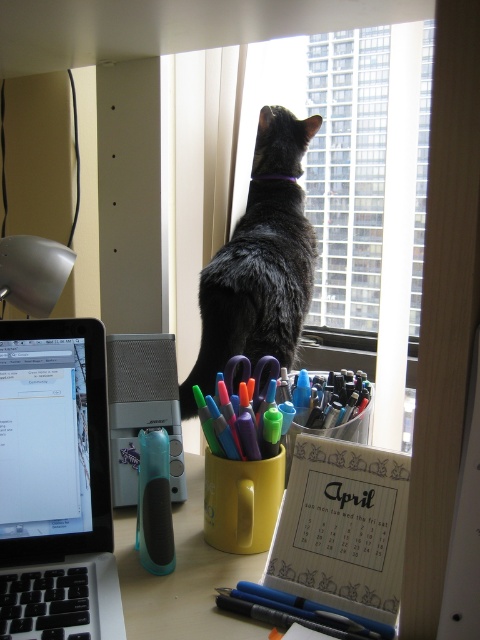
Does silver metallic laptop at left appear on the right side of matte black pen at lower center?

No, silver metallic laptop at left is not to the right of matte black pen at lower center.

Can you confirm if silver metallic laptop at left is positioned to the left of matte black pen at lower center?

Yes, silver metallic laptop at left is to the left of matte black pen at lower center.

Is point (20, 433) closer to viewer compared to point (255, 596)?

No, (20, 433) is behind (255, 596).

At what (x,y) coordinates should I click in order to perform the action: click on silver metallic laptop at left. Please return your answer as a coordinate pair (x, y). The width and height of the screenshot is (480, 640). Looking at the image, I should click on (56, 483).

Does silver metallic laptop at left appear on the left side of wooden calendar at center?

Indeed, silver metallic laptop at left is positioned on the left side of wooden calendar at center.

Between silver metallic laptop at left and wooden calendar at center, which one has less height?

With less height is wooden calendar at center.

Is point (3, 616) positioned behind point (384, 464)?

No, (3, 616) is in front of (384, 464).

Where is `silver metallic laptop at left`? silver metallic laptop at left is located at coordinates (56, 483).

Does point (95, 481) come behind point (268, 436)?

No.

Is silver metallic laptop at left smaller than matte plastic cup at center?

Incorrect, silver metallic laptop at left is not smaller in size than matte plastic cup at center.

Is point (28, 344) in front of point (272, 444)?

Yes, point (28, 344) is closer to viewer.

I want to click on silver metallic laptop at left, so click(x=56, y=483).